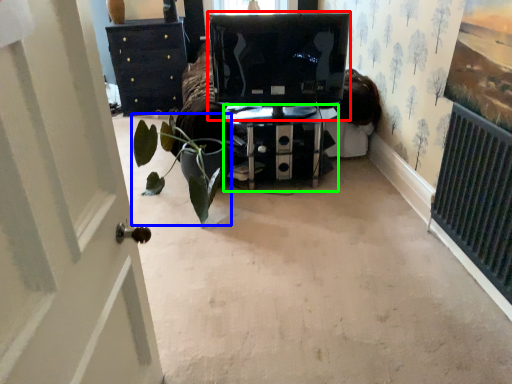
Question: Which is farther away from computer monitor (highlighted by a red box)? houseplant (highlighted by a blue box) or furniture (highlighted by a green box)?

Choices:
 (A) houseplant
 (B) furniture

Answer: (A)